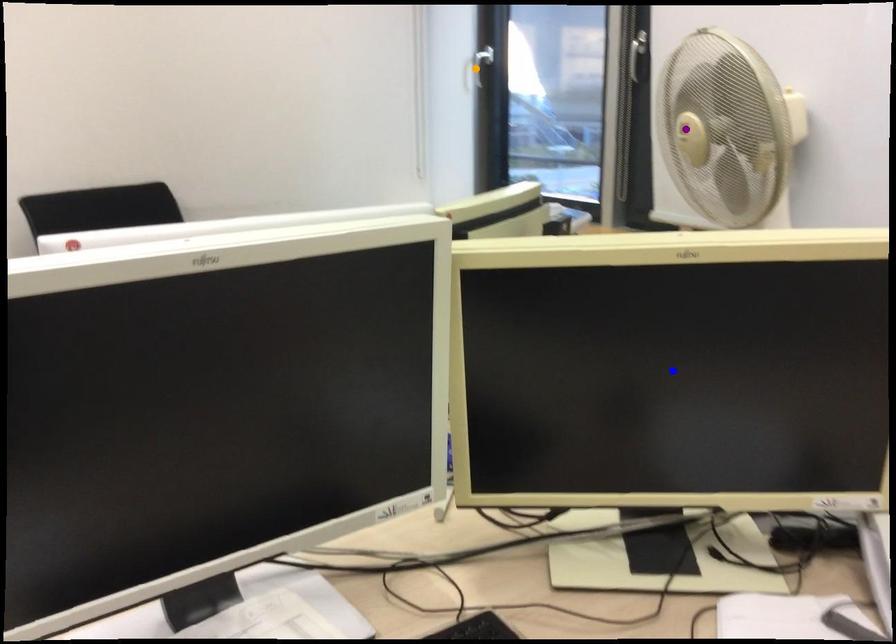
Order these from nearest to farthest:
1. blue point
2. orange point
3. purple point

blue point → purple point → orange point